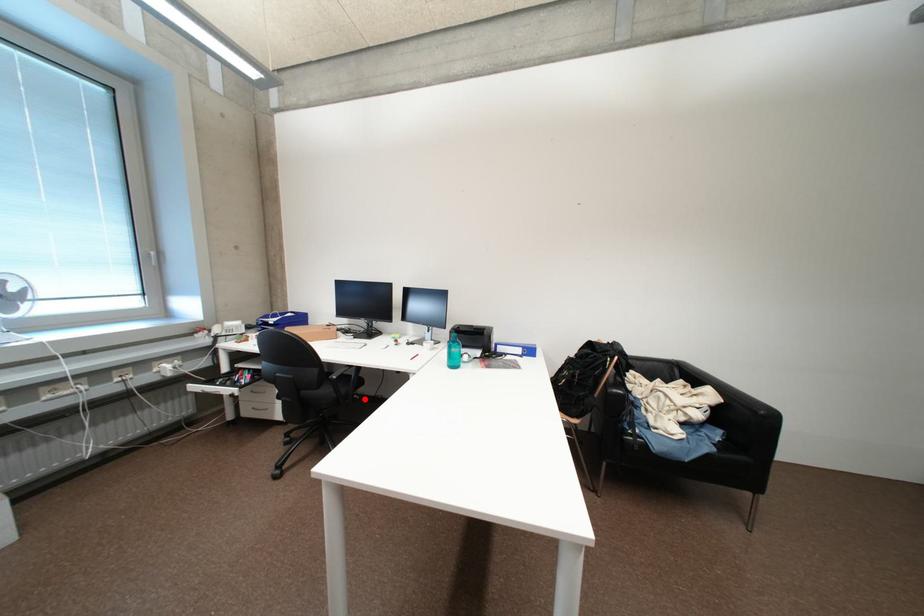
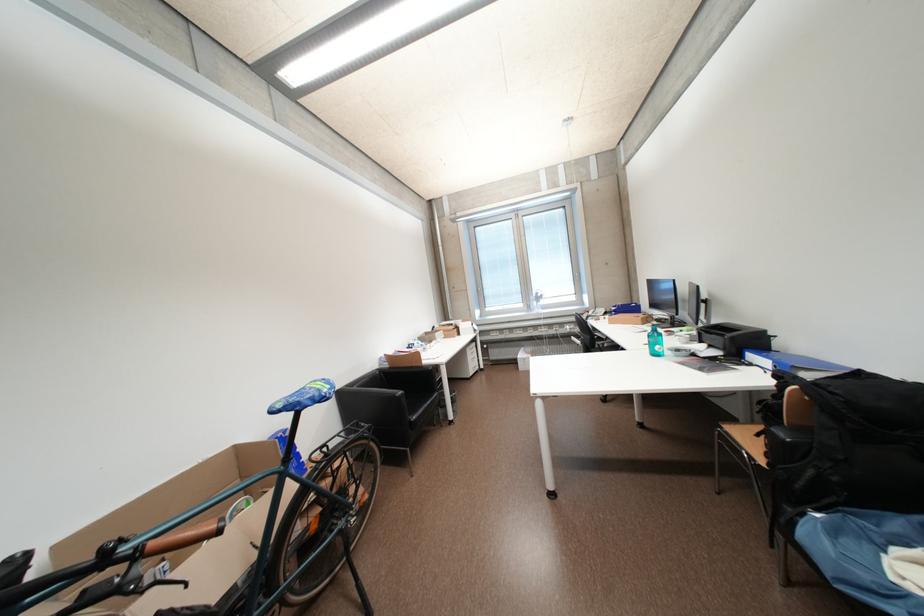
Question: I am providing you with two images of the same scene from different viewpoints. A red point is marked on the first image. Is the red point's position out of view in image 2?

Choices:
 (A) Yes
 (B) No

Answer: (A)